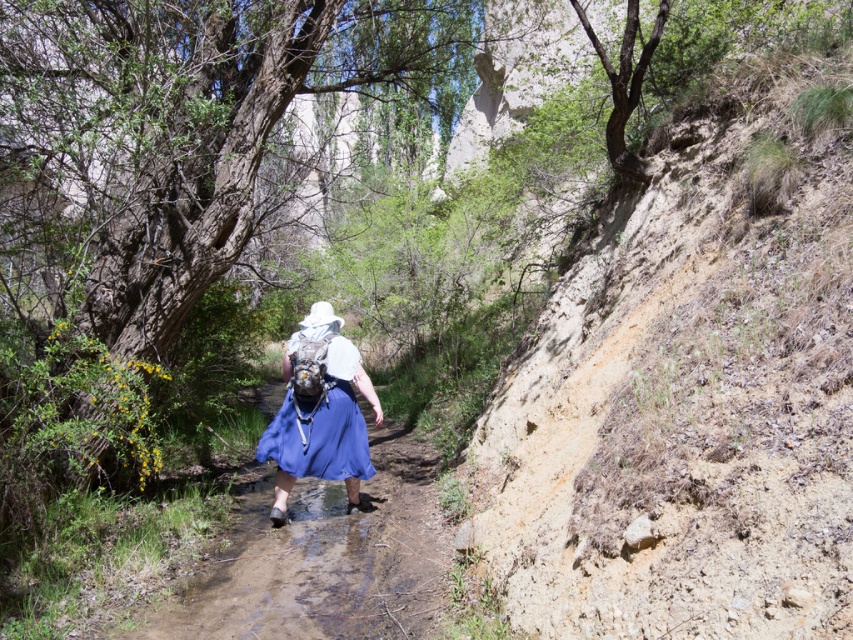
Question: Does blue fabric skirt at center appear over blue satin dress at center?

Choices:
 (A) yes
 (B) no

Answer: (B)

Question: Among these objects, which one is nearest to the camera?

Choices:
 (A) blue satin dress at center
 (B) blue fabric skirt at center

Answer: (B)

Question: Which point appears closest to the camera in this image?

Choices:
 (A) (351, 394)
 (B) (321, 547)

Answer: (B)

Question: Does blue fabric skirt at center have a greater width compared to blue satin dress at center?

Choices:
 (A) no
 (B) yes

Answer: (A)

Question: Is blue fabric skirt at center thinner than blue satin dress at center?

Choices:
 (A) no
 (B) yes

Answer: (B)

Question: Which point is farther from the camera taking this photo?

Choices:
 (A) (271, 454)
 (B) (288, 538)

Answer: (A)